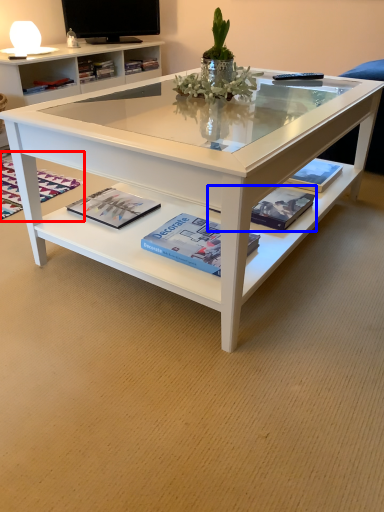
Question: Which object appears closest to the camera in this image, magazine (highlighted by a red box) or magazine (highlighted by a blue box)?

Choices:
 (A) magazine
 (B) magazine

Answer: (B)